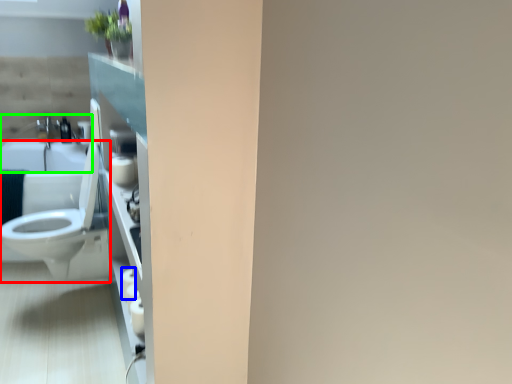
Question: Which is farther away from toilet (highlighted by a red box)? toilet paper (highlighted by a blue box) or sink (highlighted by a green box)?

Choices:
 (A) toilet paper
 (B) sink

Answer: (B)